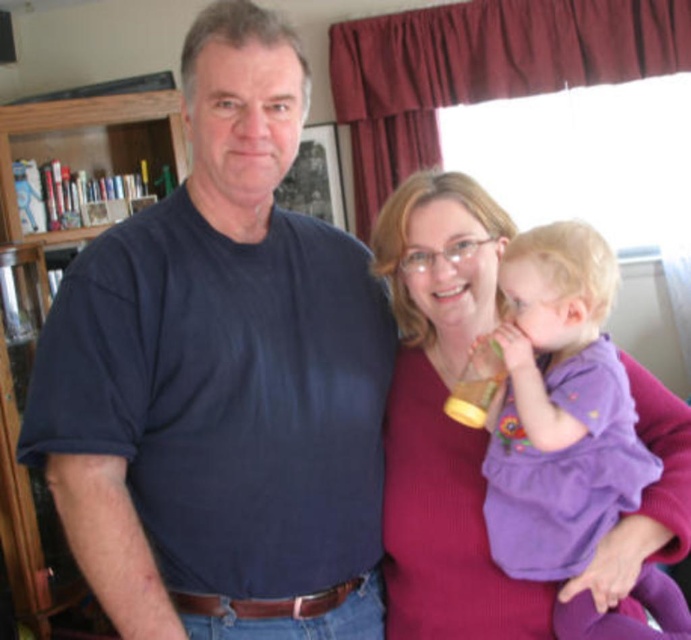
Is dark blue t-shirt at left to the left of purple soft fabric baby at center from the viewer's perspective?

Yes, dark blue t-shirt at left is to the left of purple soft fabric baby at center.

Measure the distance between dark blue t-shirt at left and camera.

The distance of dark blue t-shirt at left from camera is 39.35 inches.

At what (x,y) coordinates should I click in order to perform the action: click on dark blue t-shirt at left. Please return your answer as a coordinate pair (x, y). The width and height of the screenshot is (691, 640). Looking at the image, I should click on (220, 380).

Does dark blue t-shirt at left have a smaller size compared to wooden bookshelf at left?

Yes, dark blue t-shirt at left is smaller than wooden bookshelf at left.

From the picture: Can you confirm if dark blue t-shirt at left is taller than wooden bookshelf at left?

Yes.

Is point (261, 344) closer to camera compared to point (120, 115)?

Yes, point (261, 344) is closer to viewer.

Find the location of a particular element. dark blue t-shirt at left is located at coordinates (220, 380).

Between purple soft fabric baby at center and wooden bookshelf at left, which one is positioned lower?

Positioned lower is purple soft fabric baby at center.

Between point (515, 292) and point (124, 120), which one is positioned in front?

Positioned in front is point (515, 292).

You are a GUI agent. You are given a task and a screenshot of the screen. Output one action in this format:
    pyautogui.click(x=<x>, y=<y>)
    Task: Click on the purple soft fabric baby at center
    The height and width of the screenshot is (640, 691).
    Given the screenshot: What is the action you would take?
    pyautogui.click(x=558, y=408)